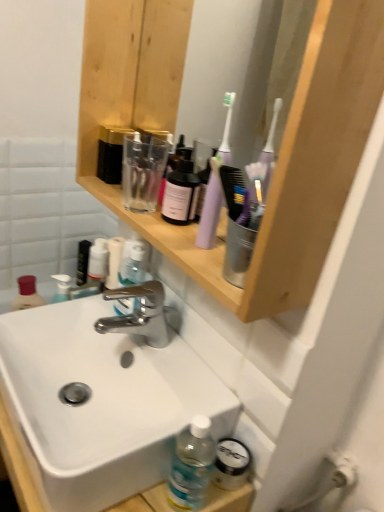
Question: From a real-world perspective, is black matte tube at upper left physically located above or below wooden shelf at upper center?

Choices:
 (A) below
 (B) above

Answer: (A)

Question: Based on their positions, is black matte tube at upper left located to the left or right of wooden shelf at upper center?

Choices:
 (A) right
 (B) left

Answer: (B)

Question: Considering the real-world distances, which object is farthest from the polished chrome faucet at center?

Choices:
 (A) white glossy sink at center
 (B) purple plastic toothbrush at upper center
 (C) wooden shelf at upper center
 (D) black matte tube at upper left
 (E) transparent plastic bottle at upper center

Answer: (D)

Question: Which object is the farthest from the polished chrome faucet at center?

Choices:
 (A) purple plastic toothbrush at upper center
 (B) wooden shelf at upper center
 (C) black matte tube at upper left
 (D) transparent plastic bottle at upper center
 (E) white glossy sink at center

Answer: (C)